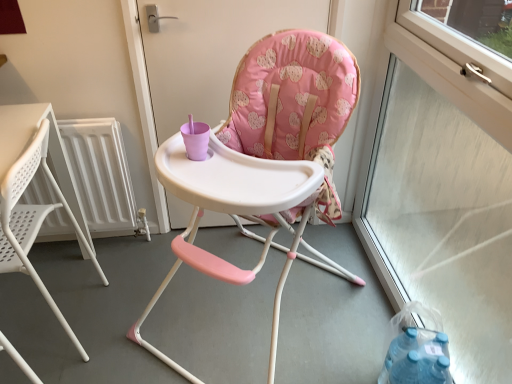
I want to click on free point in front of white metallic radiator at left, so click(x=75, y=293).